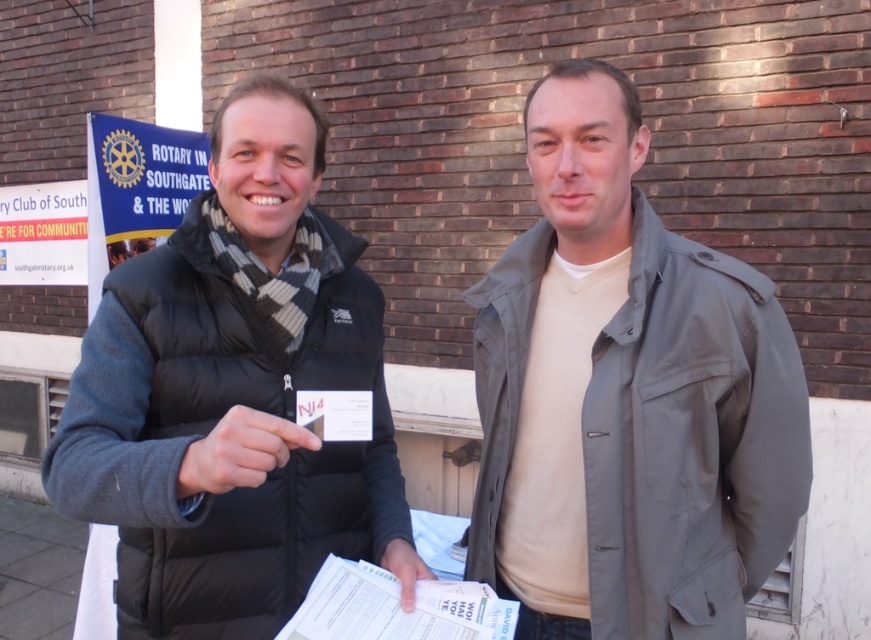
Question: Which point appears farthest from the camera in this image?

Choices:
 (A) (407, 544)
 (B) (194, 481)

Answer: (A)

Question: Is light gray fabric jacket at center to the right of black matte card at center from the viewer's perspective?

Choices:
 (A) no
 (B) yes

Answer: (B)

Question: Is black puffer vest at left thinner than black matte card at center?

Choices:
 (A) no
 (B) yes

Answer: (A)

Question: Does light gray fabric jacket at center have a larger size compared to black puffer vest at left?

Choices:
 (A) no
 (B) yes

Answer: (A)

Question: Which point is closer to the camera taking this photo?

Choices:
 (A) (494, 316)
 (B) (284, 452)
 (C) (218, 419)
 (D) (382, 560)

Answer: (B)

Question: Which is nearer to the black puffer vest at left?

Choices:
 (A) light gray fabric jacket at center
 (B) white paper at center
 (C) black matte card at center

Answer: (C)